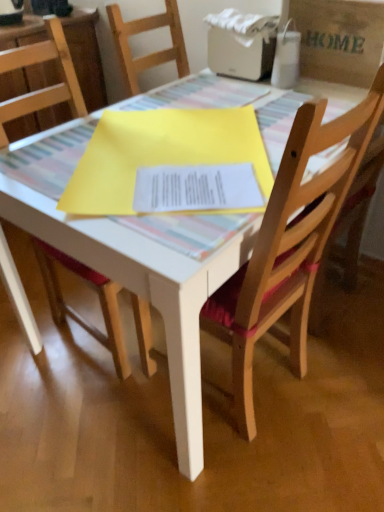
What do you see at coordinates (290, 245) in the screenshot? I see `wooden chair with red cushion at center, which is the 2th chair in left-to-right order` at bounding box center [290, 245].

Identify the location of wooden chair at center, which is the second chair in right-to-left order. (44, 88).

Is wooden chair at center, which is the second chair in right-to-left order, surrounding white plastic printer at upper center?

No, white plastic printer at upper center is not surrounded by wooden chair at center, which is the second chair in right-to-left order.

Is wooden chair at center, the first chair positioned from the left, beside white plastic printer at upper center?

No, wooden chair at center, the first chair positioned from the left, is not with white plastic printer at upper center.

Could you tell me if wooden chair at center, the first chair positioned from the left, is facing white plastic printer at upper center?

No, wooden chair at center, the first chair positioned from the left, is not oriented towards white plastic printer at upper center.

Considering the sizes of objects brown paper bag at upper right and white plastic printer at upper center in the image provided, who is taller, brown paper bag at upper right or white plastic printer at upper center?

brown paper bag at upper right is taller.

From the image's perspective, is brown paper bag at upper right under white plastic printer at upper center?

Yes, from the image's perspective, brown paper bag at upper right is beneath white plastic printer at upper center.

Does brown paper bag at upper right turn towards white plastic printer at upper center?

No, brown paper bag at upper right is not oriented towards white plastic printer at upper center.

From the picture: Which of these two, brown paper bag at upper right or white plastic printer at upper center, is thinner?

With smaller width is brown paper bag at upper right.

Can you tell me how much wooden chair at center, the first chair positioned from the left, and brown paper bag at upper right differ in facing direction?

They differ by 90 degrees in their facing directions.

Are wooden chair at center, the first chair positioned from the left, and brown paper bag at upper right far apart?

That's right, there is a large distance between wooden chair at center, the first chair positioned from the left, and brown paper bag at upper right.

You are a GUI agent. You are given a task and a screenshot of the screen. Output one action in this format:
    pyautogui.click(x=<x>, y=<y>)
    Task: Click on the 1st chair below the brown paper bag at upper right (from the image's perspective)
    The image size is (384, 512).
    Given the screenshot: What is the action you would take?
    pyautogui.click(x=44, y=88)

Measure the distance between wooden chair at center, which is the second chair in right-to-left order, and brown paper bag at upper right.

wooden chair at center, which is the second chair in right-to-left order, and brown paper bag at upper right are 3.82 feet apart.

Would you consider wooden chair with red cushion at center, which is the 2th chair in left-to-right order, to be distant from white plastic printer at upper center?

They are positioned close to each other.

Is wooden chair with red cushion at center, which is the 2th chair in left-to-right order, taller or shorter than white plastic printer at upper center?

Clearly, wooden chair with red cushion at center, which is the 2th chair in left-to-right order, is taller compared to white plastic printer at upper center.

From the image's perspective, is wooden chair with red cushion at center, which is the 2th chair in left-to-right order, on white plastic printer at upper center?

No, from the image's perspective, wooden chair with red cushion at center, which is the 2th chair in left-to-right order, is not on top of white plastic printer at upper center.

Which is more to the left, wooden chair with red cushion at center, which is the 2th chair in left-to-right order, or white plastic printer at upper center?

wooden chair with red cushion at center, which is the 2th chair in left-to-right order.

Relative to brown paper bag at upper right, is white plastic printer at upper center in front or behind?

white plastic printer at upper center is behind brown paper bag at upper right.

Is white plastic printer at upper center far from brown paper bag at upper right?

No, white plastic printer at upper center is in close proximity to brown paper bag at upper right.

Does white plastic printer at upper center appear on the right side of brown paper bag at upper right?

Incorrect, white plastic printer at upper center is not on the right side of brown paper bag at upper right.

Looking at their sizes, would you say white plastic printer at upper center is wider or thinner than brown paper bag at upper right?

white plastic printer at upper center is wider than brown paper bag at upper right.

Does white plastic printer at upper center appear on the right side of wooden chair with red cushion at center, the first chair from the right?

Yes.

Identify the location of the 2nd chair in front of the white plastic printer at upper center. This screenshot has height=512, width=384. (290, 245).

Can you confirm if white plastic printer at upper center is smaller than wooden chair with red cushion at center, which is the 2th chair in left-to-right order?

Yes.

Considering the sizes of objects white plastic printer at upper center and wooden chair with red cushion at center, which is the 2th chair in left-to-right order, in the image provided, who is thinner, white plastic printer at upper center or wooden chair with red cushion at center, which is the 2th chair in left-to-right order,?

Thinner between the two is white plastic printer at upper center.

Between white plastic printer at upper center and wooden chair at center, which is the second chair in right-to-left order, which one has smaller size?

With smaller size is white plastic printer at upper center.

Are white plastic printer at upper center and wooden chair at center, which is the second chair in right-to-left order, located far from each other?

Yes, white plastic printer at upper center and wooden chair at center, which is the second chair in right-to-left order, are located far from each other.

Between white plastic printer at upper center and wooden chair at center, which is the second chair in right-to-left order, which one has less height?

white plastic printer at upper center is shorter.

Is white plastic printer at upper center wider or thinner than wooden chair at center, the first chair positioned from the left?

Clearly, white plastic printer at upper center has less width compared to wooden chair at center, the first chair positioned from the left.

The height and width of the screenshot is (512, 384). In order to click on printer above the wooden chair at center, the first chair positioned from the left (from a real-world perspective) in this screenshot , I will do `click(241, 44)`.

You are a GUI agent. You are given a task and a screenshot of the screen. Output one action in this format:
    pyautogui.click(x=<x>, y=<y>)
    Task: Click on the cardboard box in front of the white plastic printer at upper center
    
    Given the screenshot: What is the action you would take?
    pyautogui.click(x=338, y=39)

When comparing their distances from white plastic printer at upper center, does wooden chair at center, which is the second chair in right-to-left order, or wooden chair with red cushion at center, which is the 2th chair in left-to-right order, seem closer?

wooden chair with red cushion at center, which is the 2th chair in left-to-right order, lies closer to white plastic printer at upper center than the other object.

Considering their positions, is brown paper bag at upper right positioned further to wooden chair at center, which is the second chair in right-to-left order, than white plastic printer at upper center?

Among the two, brown paper bag at upper right is located further to wooden chair at center, which is the second chair in right-to-left order.

From the image, which object appears to be farther from white plastic printer at upper center, wooden chair with red cushion at center, the first chair from the right, or brown paper bag at upper right?

wooden chair with red cushion at center, the first chair from the right, lies further to white plastic printer at upper center than the other object.

When comparing their distances from brown paper bag at upper right, does wooden chair with red cushion at center, the first chair from the right, or wooden chair at center, the first chair positioned from the left, seem further?

wooden chair at center, the first chair positioned from the left, is positioned further to the anchor brown paper bag at upper right.

When comparing their distances from wooden chair with red cushion at center, which is the 2th chair in left-to-right order, does wooden chair at center, which is the second chair in right-to-left order, or brown paper bag at upper right seem closer?

Among the two, wooden chair at center, which is the second chair in right-to-left order, is located nearer to wooden chair with red cushion at center, which is the 2th chair in left-to-right order.

Based on their spatial positions, is white plastic printer at upper center or wooden chair with red cushion at center, which is the 2th chair in left-to-right order, closer to brown paper bag at upper right?

white plastic printer at upper center lies closer to brown paper bag at upper right than the other object.

Estimate the real-world distances between objects in this image. Which object is further from wooden chair with red cushion at center, the first chair from the right, white plastic printer at upper center or wooden chair at center, which is the second chair in right-to-left order?

white plastic printer at upper center.

Based on their spatial positions, is white plastic printer at upper center or wooden chair with red cushion at center, which is the 2th chair in left-to-right order, closer to wooden chair at center, the first chair positioned from the left?

Among the two, wooden chair with red cushion at center, which is the 2th chair in left-to-right order, is located nearer to wooden chair at center, the first chair positioned from the left.

Identify the location of printer between wooden chair at center, which is the second chair in right-to-left order, and brown paper bag at upper right from left to right. The height and width of the screenshot is (512, 384). (241, 44).

You are a GUI agent. You are given a task and a screenshot of the screen. Output one action in this format:
    pyautogui.click(x=<x>, y=<y>)
    Task: Click on the chair between wooden chair with red cushion at center, which is the 2th chair in left-to-right order, and white plastic printer at upper center in the front-back direction
    The height and width of the screenshot is (512, 384).
    Given the screenshot: What is the action you would take?
    pyautogui.click(x=44, y=88)

Locate an element on the screen. The width and height of the screenshot is (384, 512). chair located between wooden chair at center, which is the second chair in right-to-left order, and brown paper bag at upper right in the left-right direction is located at coordinates (290, 245).

At what (x,y) coordinates should I click in order to perform the action: click on cardboard box between wooden chair with red cushion at center, the first chair from the right, and white plastic printer at upper center, along the z-axis. Please return your answer as a coordinate pair (x, y). Looking at the image, I should click on (338, 39).